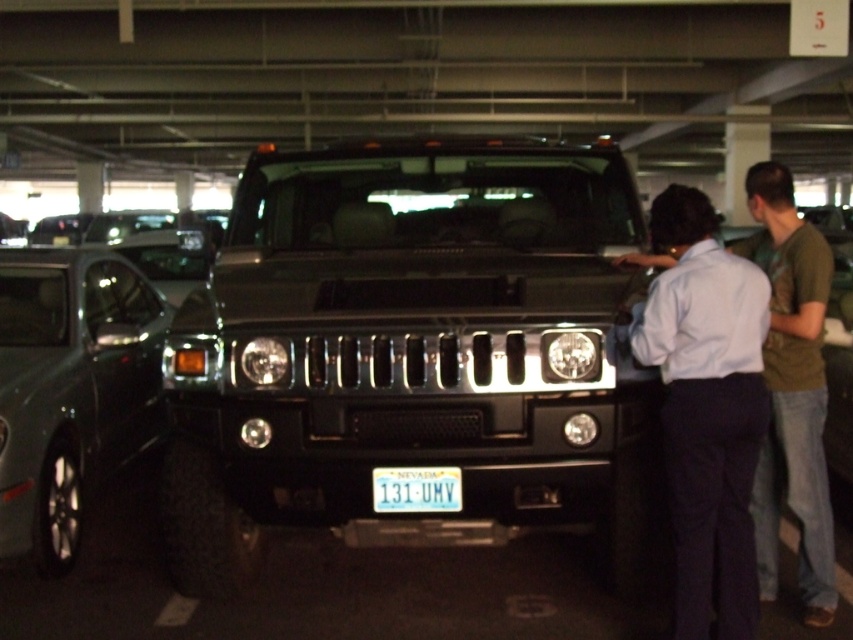
Question: Can you confirm if shiny black suv at center is positioned above green cotton shirt at right?

Choices:
 (A) yes
 (B) no

Answer: (A)

Question: Which of these objects is positioned closest to the satin silver car at left?

Choices:
 (A) shiny black suv at center
 (B) blue metallic license plate at center
 (C) green cotton shirt at right
 (D) light blue shirt at center

Answer: (A)

Question: Is satin silver car at left wider than light blue shirt at center?

Choices:
 (A) no
 (B) yes

Answer: (B)

Question: Which point is farther from the camera taking this photo?

Choices:
 (A) (238, 396)
 (B) (379, 481)
 (C) (704, 396)
 (D) (0, 282)

Answer: (D)

Question: Which of the following is the farthest from the observer?

Choices:
 (A) light blue shirt at center
 (B) satin silver car at left
 (C) shiny black suv at center

Answer: (B)

Question: Is shiny black suv at center to the left of green cotton shirt at right from the viewer's perspective?

Choices:
 (A) no
 (B) yes

Answer: (B)